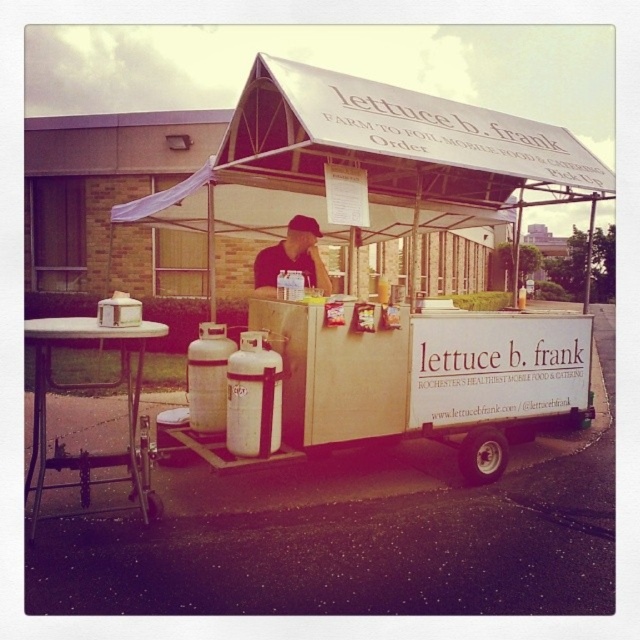
Does wooden food cart at center come in front of matte black shirt at center?

Yes, wooden food cart at center is closer to the viewer.

Between point (369, 323) and point (317, 257), which one is positioned in front?

Positioned in front is point (369, 323).

Where is `wooden food cart at center`? wooden food cart at center is located at coordinates (410, 259).